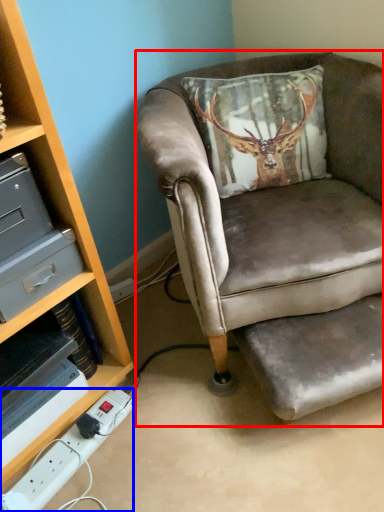
Question: Which object appears farthest to the camera in this image, chair (highlighted by a red box) or power outlet (highlighted by a blue box)?

Choices:
 (A) chair
 (B) power outlet

Answer: (B)